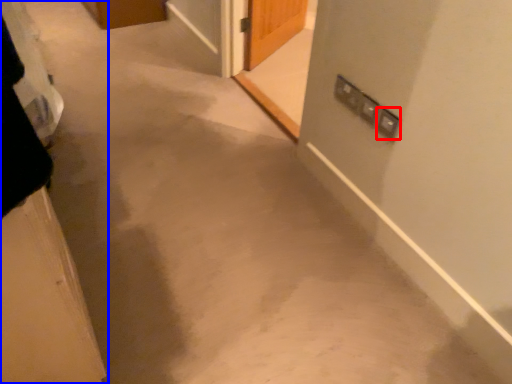
Question: Which object is further to the camera taking this photo, electric outlet (highlighted by a red box) or door (highlighted by a blue box)?

Choices:
 (A) electric outlet
 (B) door

Answer: (A)